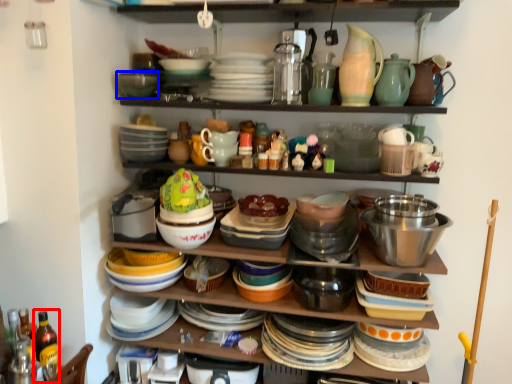
Question: Which point is closer to the camera, bottle (highlighted by a red box) or bowl (highlighted by a blue box)?

Choices:
 (A) bottle
 (B) bowl

Answer: (A)